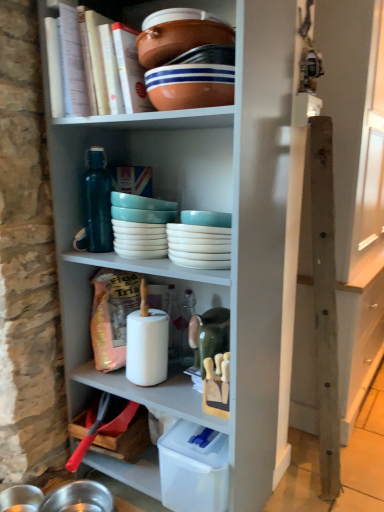
Question: From the image's perspective, is hardcover book at upper center under wooden post at right?

Choices:
 (A) no
 (B) yes

Answer: (A)

Question: From a real-world perspective, is hardcover book at upper center located higher than wooden post at right?

Choices:
 (A) no
 (B) yes

Answer: (B)

Question: Can you confirm if hardcover book at upper center is thinner than wooden post at right?

Choices:
 (A) yes
 (B) no

Answer: (A)

Question: Can you confirm if hardcover book at upper center is bigger than wooden post at right?

Choices:
 (A) yes
 (B) no

Answer: (B)

Question: Does hardcover book at upper center have a greater width compared to wooden post at right?

Choices:
 (A) no
 (B) yes

Answer: (A)

Question: In the image, is white glossy bowls at center, the 2th tableware viewed from the left, positioned in front of or behind matte ceramic bowl at upper center, which appears as the first bowl when ordered from the bottom?

Choices:
 (A) behind
 (B) front

Answer: (A)

Question: From the image's perspective, is white glossy bowls at center, the 1th tableware viewed from the right, positioned above or below matte ceramic bowl at upper center, which appears as the first bowl when ordered from the bottom?

Choices:
 (A) above
 (B) below

Answer: (B)

Question: Considering the positions of white glossy bowls at center, the 1th tableware viewed from the right, and matte ceramic bowl at upper center, which appears as the first bowl when ordered from the bottom, in the image, is white glossy bowls at center, the 1th tableware viewed from the right, wider or thinner than matte ceramic bowl at upper center, which appears as the first bowl when ordered from the bottom,?

Choices:
 (A) thin
 (B) wide

Answer: (B)

Question: Does point (193, 265) appear closer or farther from the camera than point (163, 106)?

Choices:
 (A) farther
 (B) closer

Answer: (A)

Question: From a real-world perspective, is matte ceramic bowl at upper center, which appears as the first bowl when ordered from the bottom, above or below white glossy bowls at center, the 2th tableware viewed from the left?

Choices:
 (A) below
 (B) above

Answer: (B)

Question: Choose the correct answer: Is matte ceramic bowl at upper center, which appears as the first bowl when ordered from the bottom, inside white glossy bowls at center, the 2th tableware viewed from the left, or outside it?

Choices:
 (A) outside
 (B) inside

Answer: (A)

Question: Would you say matte ceramic bowl at upper center, which appears as the first bowl when ordered from the bottom, is to the left or to the right of white glossy bowls at center, the 2th tableware viewed from the left, in the picture?

Choices:
 (A) right
 (B) left

Answer: (B)

Question: In terms of height, does matte ceramic bowl at upper center, which appears as the first bowl when ordered from the bottom, look taller or shorter compared to white glossy bowls at center, the 1th tableware viewed from the right?

Choices:
 (A) short
 (B) tall

Answer: (A)

Question: Is brown ceramic bowl at upper center, the 2th bowl when ordered from bottom to top, inside the boundaries of matte ceramic bowl at upper center, which appears as the first bowl when ordered from the bottom, or outside?

Choices:
 (A) inside
 (B) outside

Answer: (B)

Question: In terms of height, does brown ceramic bowl at upper center, the 2th bowl when ordered from bottom to top, look taller or shorter compared to matte ceramic bowl at upper center, which appears as the first bowl when ordered from the bottom?

Choices:
 (A) tall
 (B) short

Answer: (B)